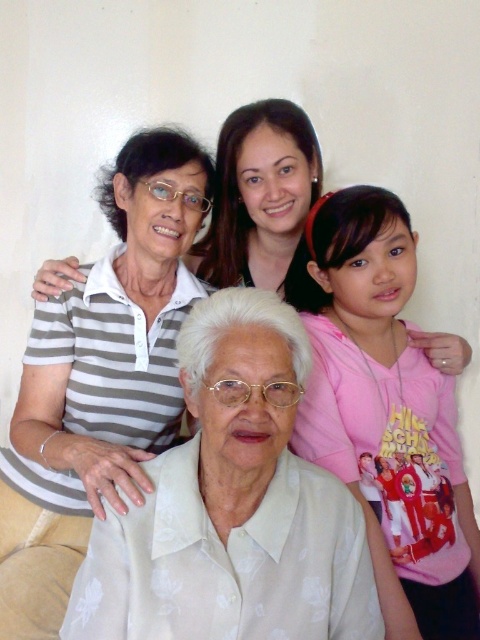
Which of the two shirts, the gray striped shirt at upper left or the pink cotton shirt at upper right, has a greater width?

The gray striped shirt at upper left might be wider than the pink cotton shirt at upper right.

You are a photographer trying to adjust the composition of the group photo. You need to ensure that the gray striped shirt at upper left and the pink cotton shirt at upper right are aligned symmetrically. Which shirt should you move to the right to achieve this symmetry?

The gray striped shirt at upper left is positioned on the left side of the pink cotton shirt at upper right. To achieve symmetry, you should move the gray striped shirt at upper left to the right so that both shirts are equidistant from the center of the image.

You are a photographer adjusting the lighting for a group photo. You need to ensure that both the gray striped shirt at upper left and the pink cotton shirt at upper right are evenly lit. Which shirt requires more light adjustment to match the other?

The gray striped shirt at upper left has a larger size compared to pink cotton shirt at upper right, so it requires more light adjustment to ensure both are evenly lit.